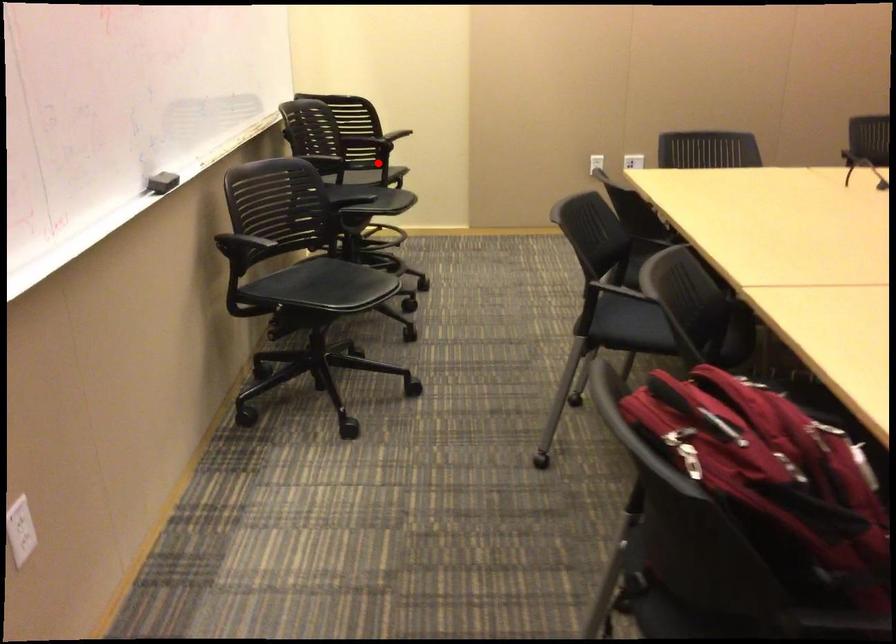
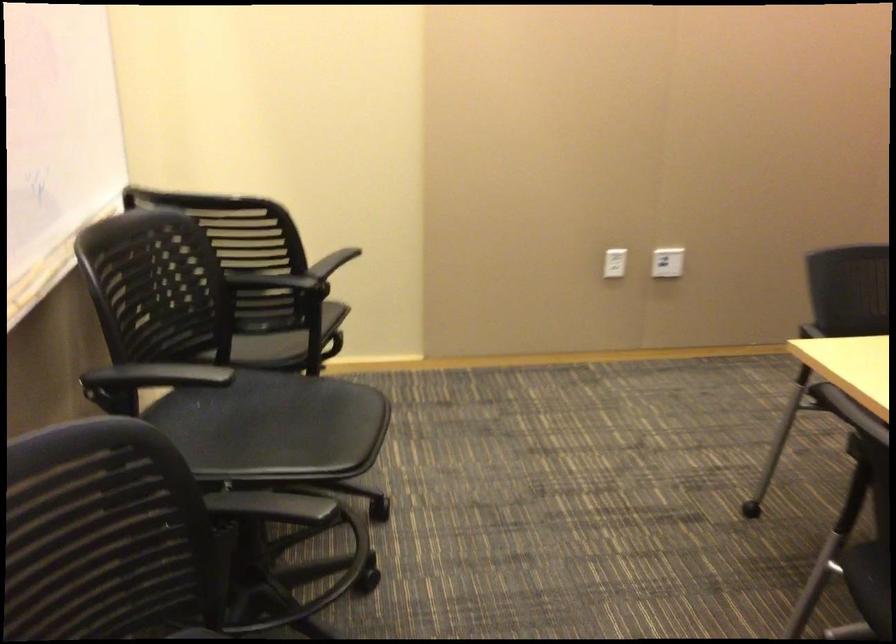
Where in the second image is the point corresponding to the highlighted location from the first image?

(287, 341)